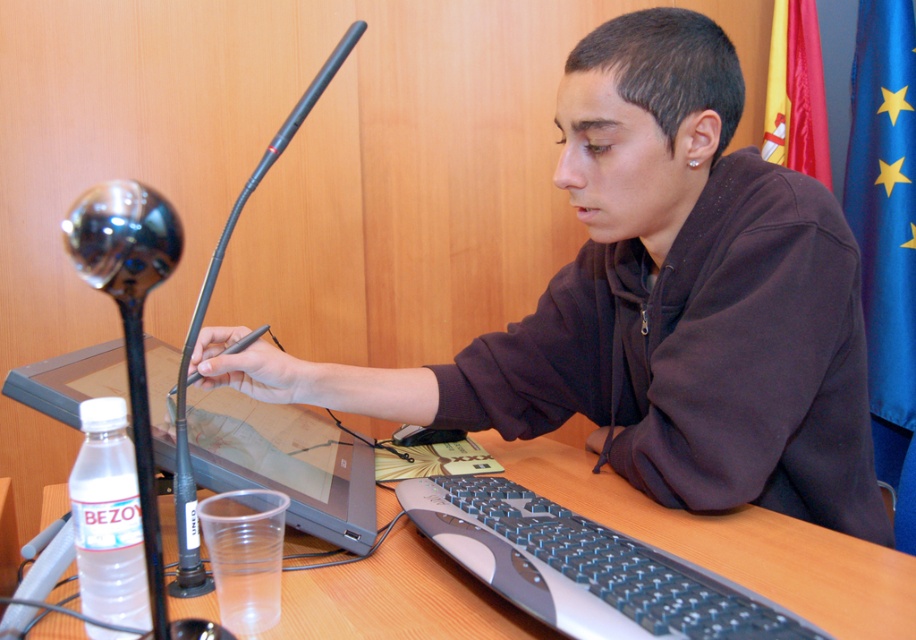
Question: Is the position of wooden table at center less distant than that of matte black laptop at left?

Choices:
 (A) yes
 (B) no

Answer: (A)

Question: Considering the real-world distances, which object is farthest from the matte black laptop at left?

Choices:
 (A) black plastic mouse at center
 (B) matte black laptop at center
 (C) silver/black keyboard at lower center
 (D) wooden table at center

Answer: (B)

Question: Among these points, which one is nearest to the camera?

Choices:
 (A) (649, 86)
 (B) (350, 472)

Answer: (A)

Question: Which of the following is the farthest from the observer?

Choices:
 (A) black plastic mouse at center
 (B) matte black laptop at center
 (C) wooden table at center
 (D) silver/black keyboard at lower center

Answer: (A)

Question: Can you confirm if matte black laptop at center is positioned above wooden table at center?

Choices:
 (A) yes
 (B) no

Answer: (A)

Question: Can you confirm if matte black laptop at center is bigger than matte black laptop at left?

Choices:
 (A) no
 (B) yes

Answer: (B)